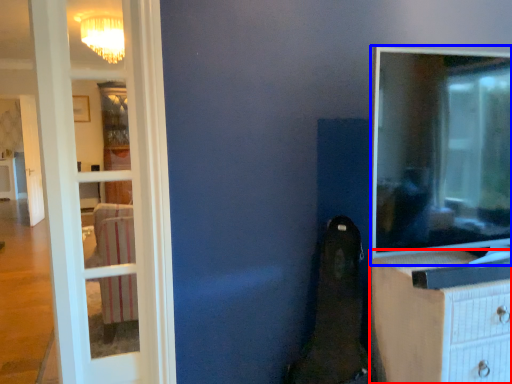
Question: Among these objects, which one is nearest to the camera, chest of drawers (highlighted by a red box) or tv show (highlighted by a blue box)?

Choices:
 (A) chest of drawers
 (B) tv show

Answer: (A)